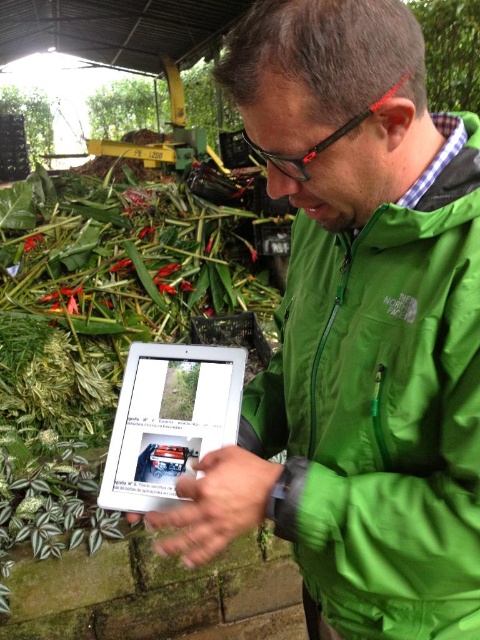
Question: Which of the following is the farthest from the observer?

Choices:
 (A) green leafy plant at center
 (B) green fabric jacket at center

Answer: (A)

Question: Which of these objects is positioned farthest from the silver metallic tablet at center?

Choices:
 (A) green fabric jacket at center
 (B) green leafy plant at center

Answer: (B)

Question: Does green fabric jacket at center have a greater width compared to green leafy plant at center?

Choices:
 (A) no
 (B) yes

Answer: (A)

Question: From the image, what is the correct spatial relationship of green fabric jacket at center in relation to green leafy plant at center?

Choices:
 (A) above
 (B) below

Answer: (B)

Question: Estimate the real-world distances between objects in this image. Which object is closer to the green fabric jacket at center?

Choices:
 (A) green leafy plant at center
 (B) silver metallic tablet at center

Answer: (B)

Question: Considering the relative positions of green fabric jacket at center and silver metallic tablet at center in the image provided, where is green fabric jacket at center located with respect to silver metallic tablet at center?

Choices:
 (A) below
 (B) above

Answer: (B)